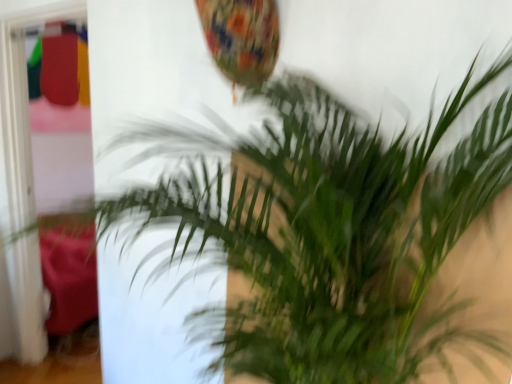
Describe the element at coordinates (21, 104) in the screenshot. This screenshot has height=384, width=512. I see `transparent glass door at left` at that location.

At what (x,y) coordinates should I click in order to perform the action: click on transparent glass door at left. Please return your answer as a coordinate pair (x, y). Looking at the image, I should click on (21, 104).

Measure the distance between point (15, 175) and camera.

They are 7.82 feet apart.

This screenshot has width=512, height=384. Find the location of `transparent glass door at left`. transparent glass door at left is located at coordinates (21, 104).